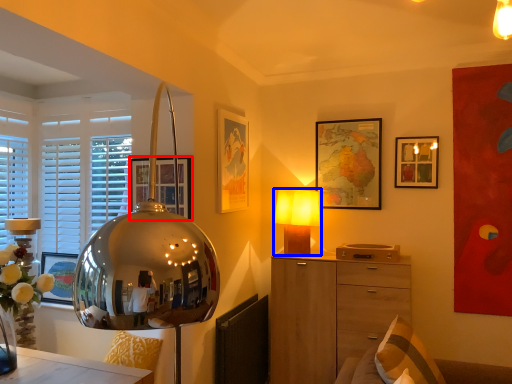
Question: Which object is further to the camera taking this photo, picture frame (highlighted by a red box) or lamp (highlighted by a blue box)?

Choices:
 (A) picture frame
 (B) lamp

Answer: (B)